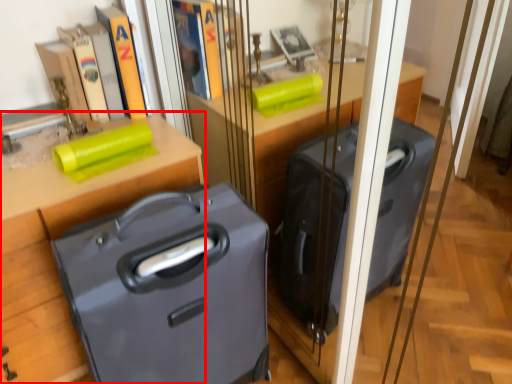
Question: Observing the image, what is the correct spatial positioning of furniture (annotated by the red box) in reference to suitcase?

Choices:
 (A) left
 (B) right

Answer: (A)